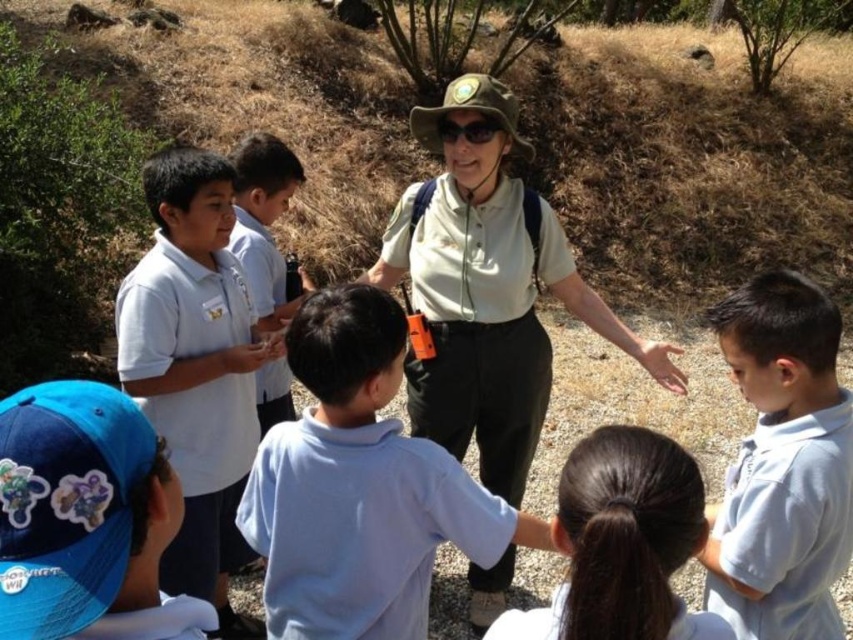
Does white cotton shirt at center come in front of white matte shirt at center?

That is True.

Who is more forward, (373, 358) or (445, 328)?

Point (373, 358) is more forward.

I want to click on white cotton shirt at center, so click(x=360, y=486).

The width and height of the screenshot is (853, 640). Identify the location of white cotton shirt at center. (360, 486).

Can you confirm if white cotton shirt at center is positioned to the right of white smooth shirt at center?

Indeed, white cotton shirt at center is positioned on the right side of white smooth shirt at center.

Where is `white cotton shirt at center`? Image resolution: width=853 pixels, height=640 pixels. white cotton shirt at center is located at coordinates (360, 486).

Who is more distant from viewer, [473,392] or [289,380]?

The point [289,380] is more distant.

Locate an element on the screen. The height and width of the screenshot is (640, 853). matte khaki shirt at center is located at coordinates (479, 321).